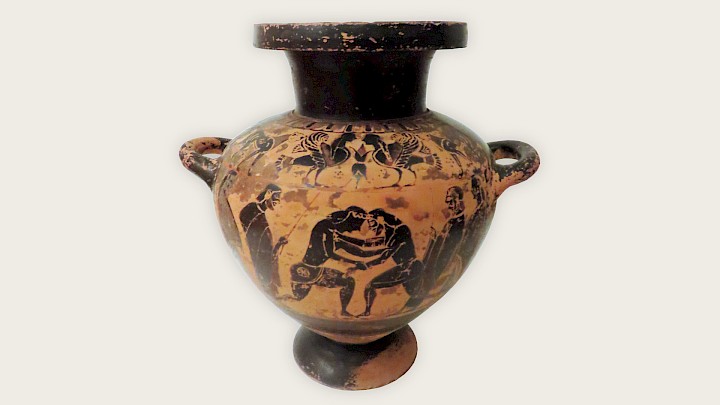
Image resolution: width=720 pixels, height=405 pixels. Find the location of `right handle`. right handle is located at coordinates (517, 161).